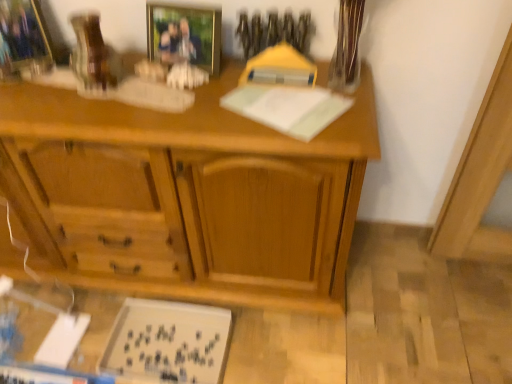
Question: Should I look upward or downward to see white matte board at lower left?

Choices:
 (A) down
 (B) up

Answer: (A)

Question: Is brushed metal picture frame at upper left, which ranks as the 2th picture frame in right-to-left order, behind clear glass vase at upper right?

Choices:
 (A) no
 (B) yes

Answer: (B)

Question: Does brushed metal picture frame at upper left, which ranks as the 2th picture frame in right-to-left order, turn towards clear glass vase at upper right?

Choices:
 (A) no
 (B) yes

Answer: (A)

Question: Does brushed metal picture frame at upper left, which ranks as the 2th picture frame in right-to-left order, come in front of clear glass vase at upper right?

Choices:
 (A) yes
 (B) no

Answer: (B)

Question: Is brushed metal picture frame at upper left, placed as the first picture frame when sorted from left to right, smaller than clear glass vase at upper right?

Choices:
 (A) yes
 (B) no

Answer: (B)

Question: Would you consider brushed metal picture frame at upper left, placed as the first picture frame when sorted from left to right, to be distant from clear glass vase at upper right?

Choices:
 (A) yes
 (B) no

Answer: (B)

Question: Is brushed metal picture frame at upper left, which ranks as the 2th picture frame in right-to-left order, to the left of clear glass vase at upper right from the viewer's perspective?

Choices:
 (A) no
 (B) yes

Answer: (B)

Question: Does wooden desk at center have a lesser height compared to clear glass vase at upper right?

Choices:
 (A) no
 (B) yes

Answer: (A)

Question: Does wooden desk at center contain clear glass vase at upper right?

Choices:
 (A) yes
 (B) no

Answer: (B)

Question: From the image's perspective, is wooden desk at center over clear glass vase at upper right?

Choices:
 (A) no
 (B) yes

Answer: (A)

Question: Does wooden desk at center have a larger size compared to clear glass vase at upper right?

Choices:
 (A) yes
 (B) no

Answer: (A)

Question: Is wooden desk at center at the left side of clear glass vase at upper right?

Choices:
 (A) no
 (B) yes

Answer: (B)

Question: From the image's perspective, is wooden desk at center under clear glass vase at upper right?

Choices:
 (A) no
 (B) yes

Answer: (B)

Question: From the image's perspective, is gold-framed photo at upper center, which is the 2th picture frame from left to right, on clear glass vase at upper right?

Choices:
 (A) yes
 (B) no

Answer: (A)